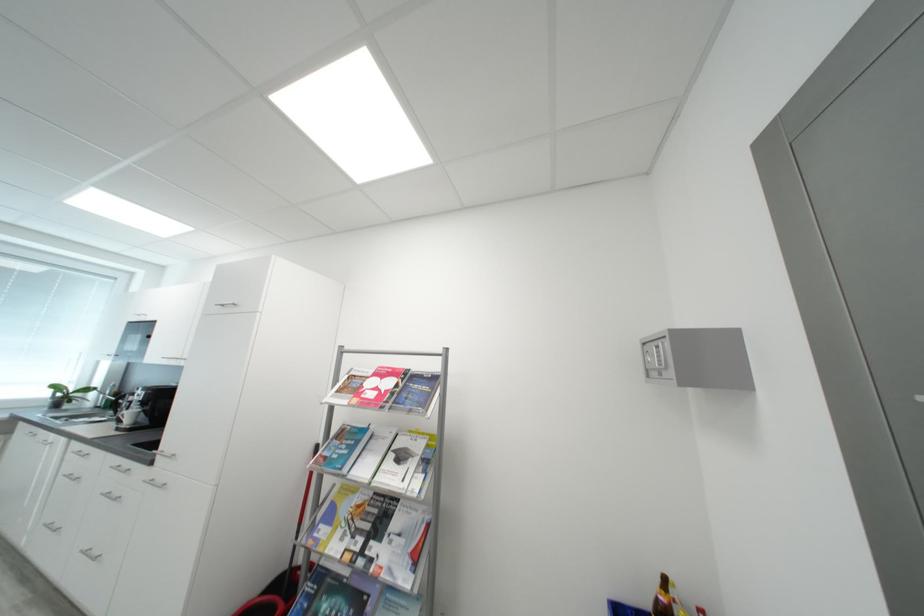
Where would you lift the small potted plant? Please return your answer as a coordinate pair (x, y).

(67, 394)